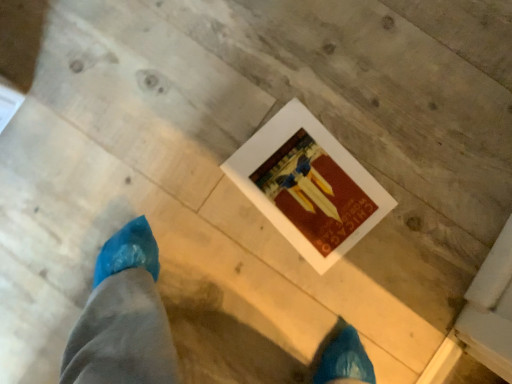
Identify the location of free space behind matte paper postcard at center. Image resolution: width=512 pixels, height=384 pixels. (259, 80).